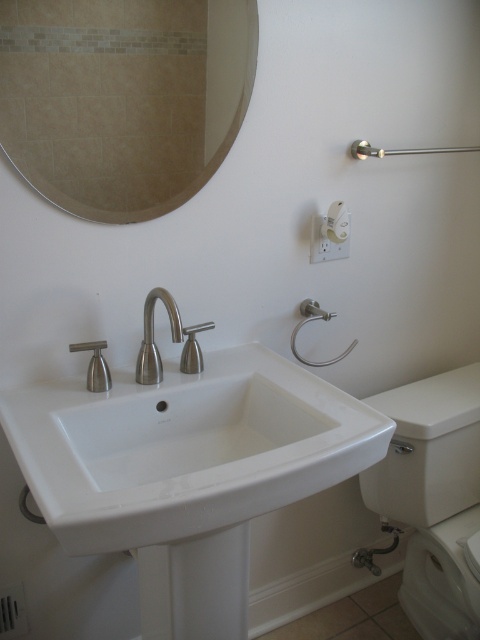
You are standing in front of the bathroom sink and want to locate the beige tile mirror at upper left. According to the coordinate system where the bottom left corner is the origin, can you tell me its position?

The beige tile mirror at upper left is located at point (122, 99).

Consider the image. You are standing in the bathroom and want to reach both the point at coordinates (x=132, y=424) and the point at coordinates (x=176, y=308). Which point will you need to stretch your hand less to touch?

The point at coordinates (x=132, y=424) is closer to you than the point at coordinates (x=176, y=308), so you will need to stretch your hand less to touch the point at (x=132, y=424).

In the bathroom scene, there is a beige tile mirror at upper left and a brushed metal faucet at center. Which object is positioned to the left of the other?

The beige tile mirror at upper left is positioned to the left of the brushed metal faucet at center.